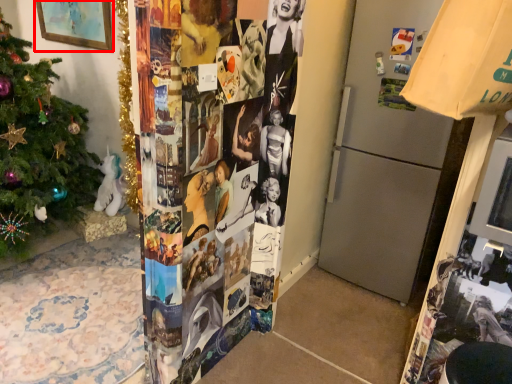
Question: In this image, where is picture frame (annotated by the red box) located relative to christmas tree?

Choices:
 (A) left
 (B) right

Answer: (A)